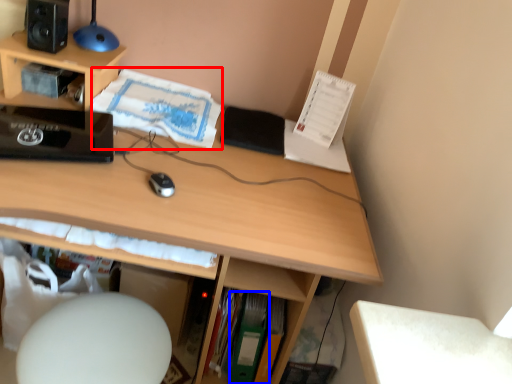
Question: Which object appears closest to the camera in this image, book (highlighted by a red box) or paperback book (highlighted by a blue box)?

Choices:
 (A) book
 (B) paperback book

Answer: (A)